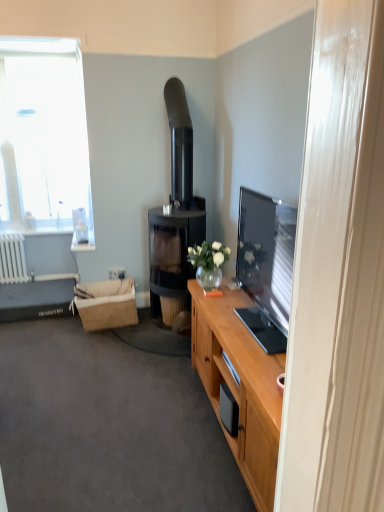
Question: From the image's perspective, is white glass window at upper left under white plastic power outlet at lower left?

Choices:
 (A) yes
 (B) no

Answer: (B)

Question: Does white glass window at upper left come behind white plastic power outlet at lower left?

Choices:
 (A) yes
 (B) no

Answer: (A)

Question: Does white glass window at upper left have a lesser height compared to white plastic power outlet at lower left?

Choices:
 (A) yes
 (B) no

Answer: (B)

Question: Are white glass window at upper left and white plastic power outlet at lower left far apart?

Choices:
 (A) no
 (B) yes

Answer: (B)

Question: From the image's perspective, is white glass window at upper left above white plastic power outlet at lower left?

Choices:
 (A) yes
 (B) no

Answer: (A)

Question: Looking at their shapes, would you say white glass window at upper left is wider or thinner than black glass fireplace at center?

Choices:
 (A) thin
 (B) wide

Answer: (A)

Question: From a real-world perspective, is white glass window at upper left positioned above or below black glass fireplace at center?

Choices:
 (A) below
 (B) above

Answer: (B)

Question: Looking at the image, does white glass window at upper left seem bigger or smaller compared to black glass fireplace at center?

Choices:
 (A) big
 (B) small

Answer: (B)

Question: From the image's perspective, relative to black glass fireplace at center, is white glass window at upper left above or below?

Choices:
 (A) below
 (B) above

Answer: (B)

Question: In the image, is white glass window at upper left positioned in front of or behind white plastic power outlet at lower left?

Choices:
 (A) front
 (B) behind

Answer: (B)

Question: Is white glass window at upper left to the left or to the right of white plastic power outlet at lower left in the image?

Choices:
 (A) right
 (B) left

Answer: (B)

Question: From a real-world perspective, is white glass window at upper left above or below white plastic power outlet at lower left?

Choices:
 (A) below
 (B) above

Answer: (B)

Question: In terms of size, does white glass window at upper left appear bigger or smaller than white plastic power outlet at lower left?

Choices:
 (A) small
 (B) big

Answer: (B)

Question: Is wooden cabinet at lower right spatially inside white plastic power outlet at lower left, or outside of it?

Choices:
 (A) outside
 (B) inside

Answer: (A)

Question: Looking at the image, does wooden cabinet at lower right seem bigger or smaller compared to white plastic power outlet at lower left?

Choices:
 (A) big
 (B) small

Answer: (A)